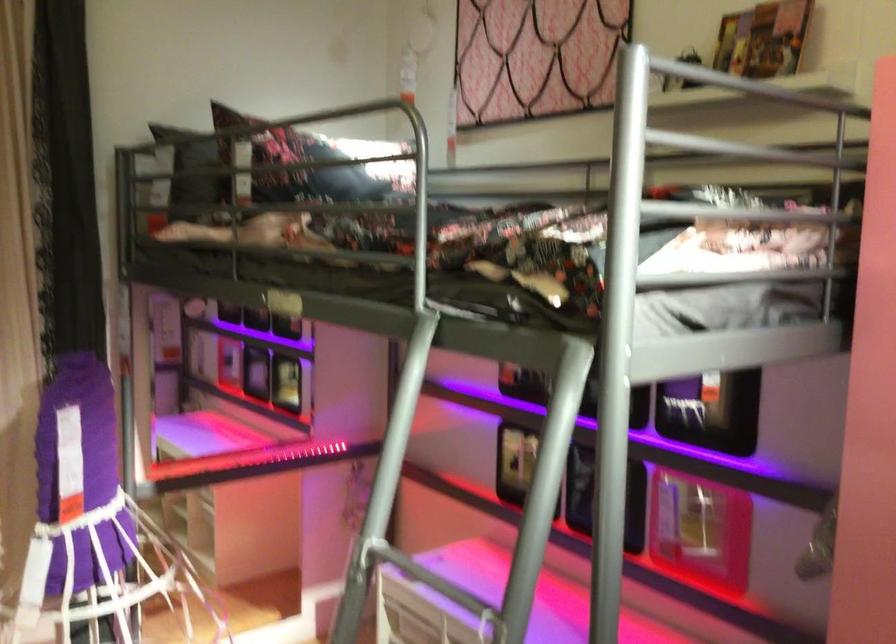
Based on the continuous images, in which direction is the camera rotating?

The camera rotated toward left-up.